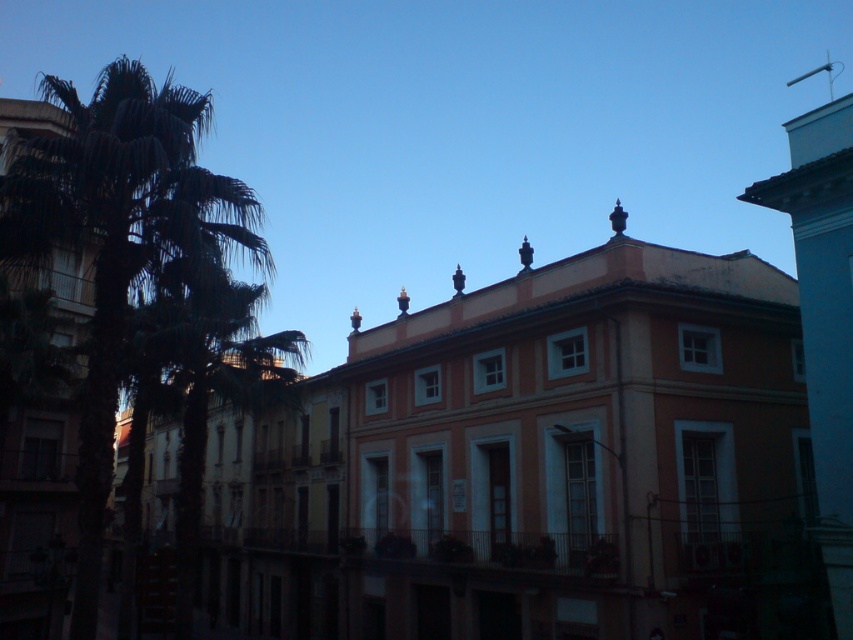
You are standing at the center of the street in the image. Looking towards the left side, you see a point marked at coordinates (128, 246). What object does this point indicate?

The point at coordinates (128, 246) marks the dark green leafy palm tree at left.

You are standing at the camera position and want to walk directly to the dark green leafy palm tree at left. How far will you have to walk?

The dark green leafy palm tree at left is 43.54 feet from the camera, so you will have to walk 43.54 feet to reach it.